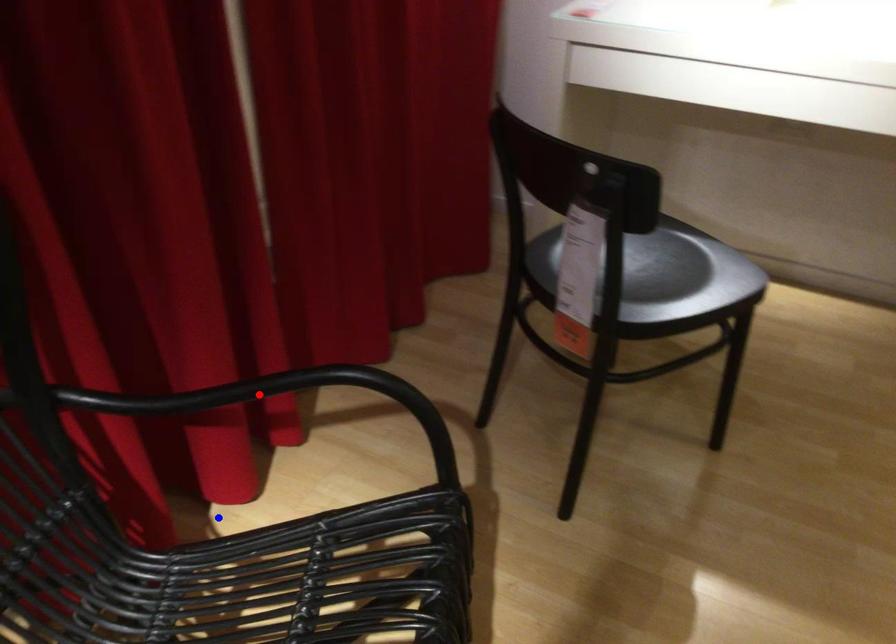
Question: Two points are marked on the image. Which point is closer to the camera?

Choices:
 (A) Blue point is closer.
 (B) Red point is closer.

Answer: (B)